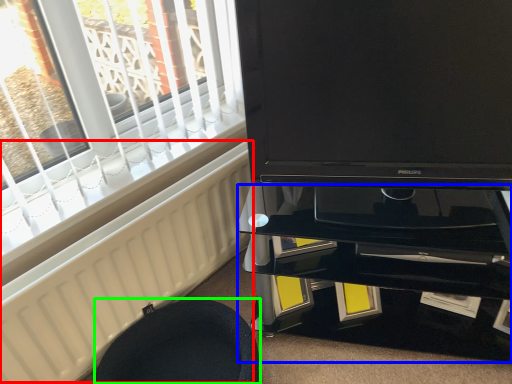
Question: Estimate the real-world distances between objects in this image. Which object is closer to radiator (highlighted by a red box), tv cabinet (highlighted by a blue box) or furniture (highlighted by a green box)?

Choices:
 (A) tv cabinet
 (B) furniture

Answer: (B)